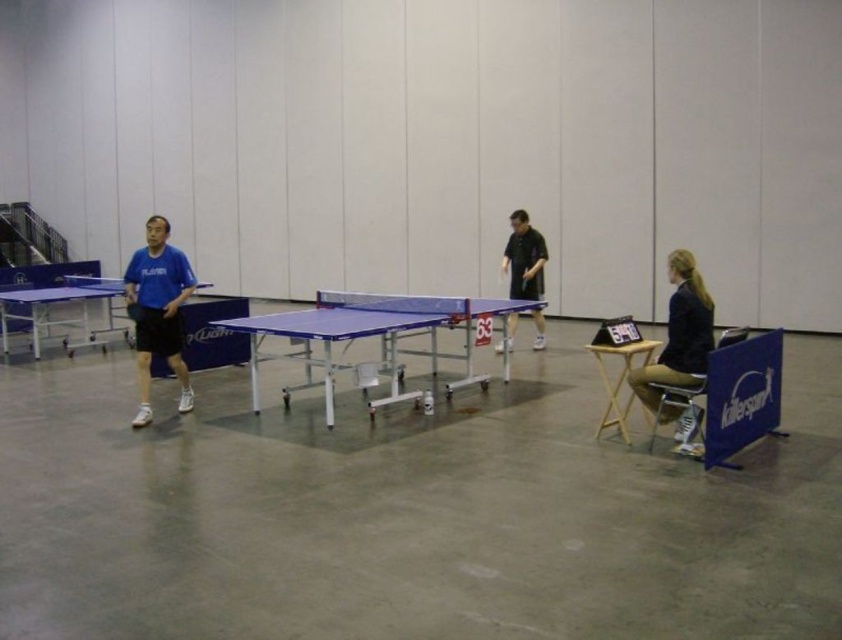
Question: Which object is farther from the camera taking this photo?

Choices:
 (A) black fabric jacket at right
 (B) blue matte shirt at left
 (C) metallic silver stool at lower right
 (D) black matte shirt at center

Answer: (D)

Question: Is blue matte shirt at left further to the viewer compared to metallic silver stool at lower right?

Choices:
 (A) yes
 (B) no

Answer: (A)

Question: Does blue matte shirt at left appear on the left side of black matte shirt at center?

Choices:
 (A) no
 (B) yes

Answer: (B)

Question: Is blue matte shirt at left smaller than blue plastic ping pong table at left?

Choices:
 (A) yes
 (B) no

Answer: (A)

Question: Which is nearer to the metallic silver stool at lower right?

Choices:
 (A) blue matte shirt at left
 (B) black matte shirt at center
 (C) light wood folding table at lower right

Answer: (C)

Question: Among these points, which one is nearest to the camera?

Choices:
 (A) (679, 424)
 (B) (137, 291)
 (C) (681, 417)
 (D) (605, 412)

Answer: (A)